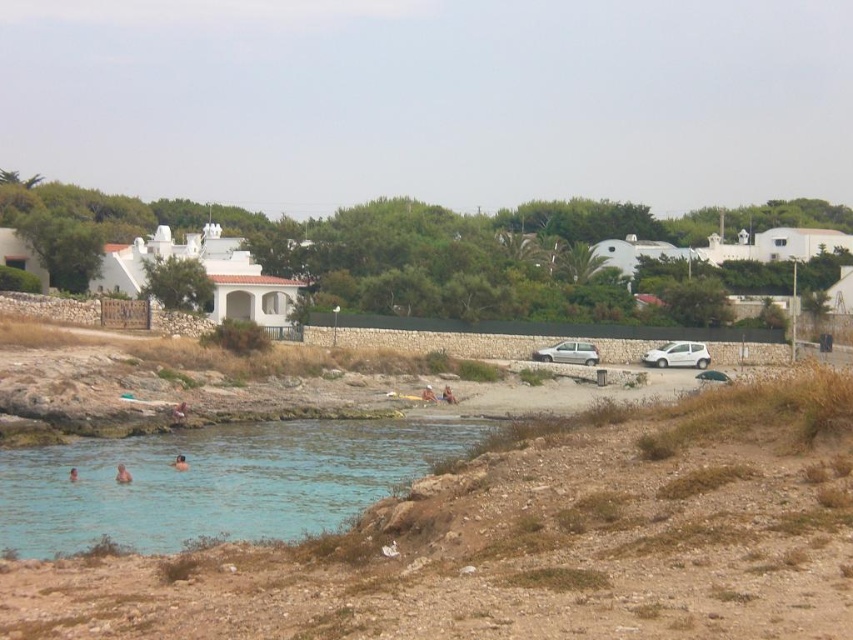
Is white matte van at right behind skinny person at lower left?

That is True.

Does white matte van at right appear over skinny person at lower left?

Yes.

Which is in front, point (665, 364) or point (74, 476)?

Positioned in front is point (74, 476).

This screenshot has height=640, width=853. I want to click on white matte van at right, so click(677, 355).

Is clear blue water at lower left bigger than skinny person at lower left?

Yes, clear blue water at lower left is bigger than skinny person at lower left.

Does point (42, 548) come closer to viewer compared to point (68, 481)?

That is True.

This screenshot has height=640, width=853. What are the coordinates of `clear blue water at lower left` in the screenshot? It's located at (213, 483).

Locate an element on the screen. clear blue water at lower left is located at coordinates (213, 483).

Is satin silver van at center closer to the viewer compared to pink skin at lower left?

No, satin silver van at center is behind pink skin at lower left.

Between satin silver van at center and pink skin at lower left, which one appears on the right side from the viewer's perspective?

satin silver van at center is more to the right.

You are a GUI agent. You are given a task and a screenshot of the screen. Output one action in this format:
    pyautogui.click(x=<x>, y=<y>)
    Task: Click on the satin silver van at center
    The width and height of the screenshot is (853, 640).
    Given the screenshot: What is the action you would take?
    (x=567, y=353)

Locate an element on the screen. Image resolution: width=853 pixels, height=640 pixels. satin silver van at center is located at coordinates click(x=567, y=353).